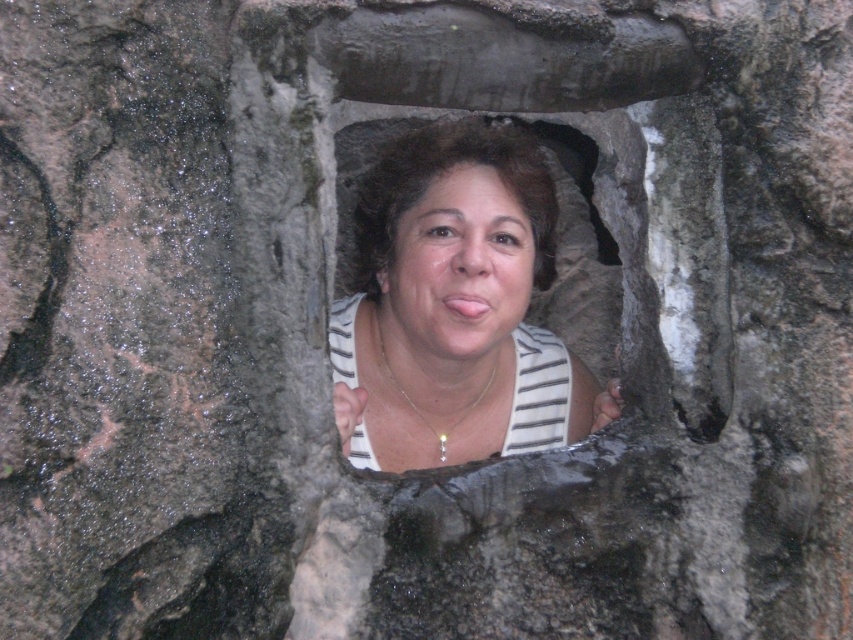
Question: Considering the relative positions of matte white tank top at center and matte white face at center in the image provided, where is matte white tank top at center located with respect to matte white face at center?

Choices:
 (A) above
 (B) below

Answer: (B)

Question: Is matte white tank top at center to the left of matte white face at center from the viewer's perspective?

Choices:
 (A) yes
 (B) no

Answer: (A)

Question: Which of the following is the farthest from the observer?

Choices:
 (A) matte white face at center
 (B) matte white tank top at center

Answer: (A)

Question: Among these points, which one is nearest to the camera?

Choices:
 (A) (422, 232)
 (B) (421, 269)

Answer: (B)

Question: Is matte white tank top at center above matte white face at center?

Choices:
 (A) no
 (B) yes

Answer: (A)